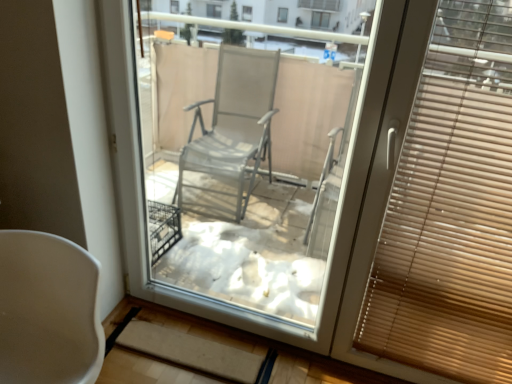
Question: Could you tell me if wooden blinds at right is facing white matte chair at lower left?

Choices:
 (A) no
 (B) yes

Answer: (A)

Question: Does wooden blinds at right have a larger size compared to white matte chair at lower left?

Choices:
 (A) yes
 (B) no

Answer: (B)

Question: Considering the relative sizes of wooden blinds at right and white matte chair at lower left in the image provided, is wooden blinds at right taller than white matte chair at lower left?

Choices:
 (A) yes
 (B) no

Answer: (A)

Question: Does wooden blinds at right come in front of white matte chair at lower left?

Choices:
 (A) no
 (B) yes

Answer: (A)

Question: Are wooden blinds at right and white matte chair at lower left located far from each other?

Choices:
 (A) yes
 (B) no

Answer: (A)

Question: From the image's perspective, would you say wooden blinds at right is shown under white matte chair at lower left?

Choices:
 (A) yes
 (B) no

Answer: (B)

Question: Does white matte chair at lower left have a greater width compared to wooden blinds at right?

Choices:
 (A) yes
 (B) no

Answer: (A)

Question: Does white matte chair at lower left have a lesser height compared to wooden blinds at right?

Choices:
 (A) no
 (B) yes

Answer: (B)

Question: Does white matte chair at lower left come behind wooden blinds at right?

Choices:
 (A) no
 (B) yes

Answer: (A)

Question: Is white matte chair at lower left aimed at wooden blinds at right?

Choices:
 (A) yes
 (B) no

Answer: (B)

Question: Is white matte chair at lower left beside wooden blinds at right?

Choices:
 (A) yes
 (B) no

Answer: (B)

Question: From the image's perspective, is white matte chair at lower left below wooden blinds at right?

Choices:
 (A) no
 (B) yes

Answer: (B)

Question: From a real-world perspective, relative to white matte chair at lower left, is wooden blinds at right vertically above or below?

Choices:
 (A) below
 (B) above

Answer: (B)